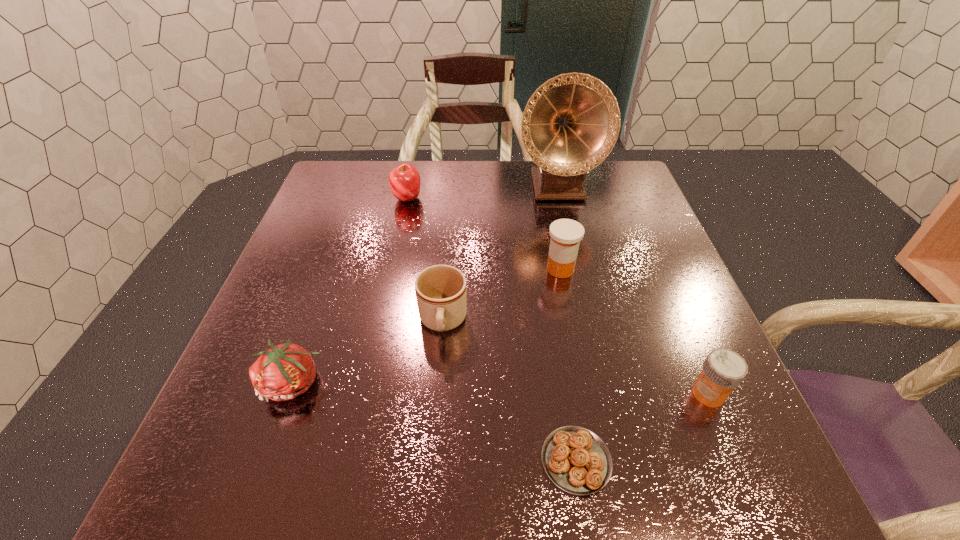
Find the location of a particular element. vacant space located 0.070m on the right of the tomato is located at coordinates (364, 383).

Identify the location of free point located 0.090m on the back of the pastry. The image size is (960, 540). (564, 381).

What are the coordinates of `phonograph record located at the far edge` in the screenshot? It's located at (571, 123).

Locate an element on the screen. This screenshot has height=540, width=960. apple that is at the far edge is located at coordinates point(404,180).

Where is `object that is at the near edge`? The image size is (960, 540). object that is at the near edge is located at coordinates (575, 459).

The image size is (960, 540). Find the location of `object present at the left edge`. object present at the left edge is located at coordinates (285, 371).

You are a GUI agent. You are given a task and a screenshot of the screen. Output one action in this format:
    pyautogui.click(x=<x>, y=<y>)
    Task: Click on the phonograph record located in the right edge section of the desktop
    Image resolution: width=960 pixels, height=540 pixels.
    Given the screenshot: What is the action you would take?
    pyautogui.click(x=571, y=123)

Identify the location of medicine present at the right edge. (723, 370).

Locate an element on the screen. This screenshot has height=540, width=960. object that is positioned at the far right corner is located at coordinates (571, 123).

You are a GUI agent. You are given a task and a screenshot of the screen. Output one action in this format:
    pyautogui.click(x=<x>, y=<y>)
    Task: Click on the vacant region at the far edge of the desktop
    The height and width of the screenshot is (540, 960).
    Given the screenshot: What is the action you would take?
    pyautogui.click(x=505, y=184)